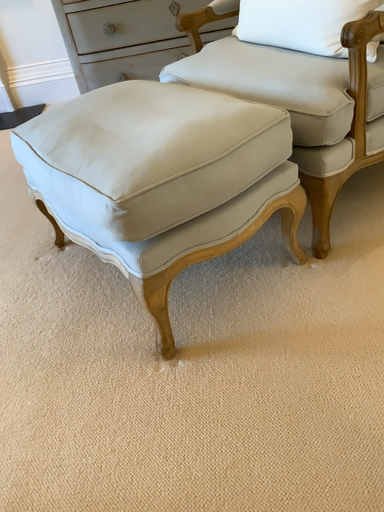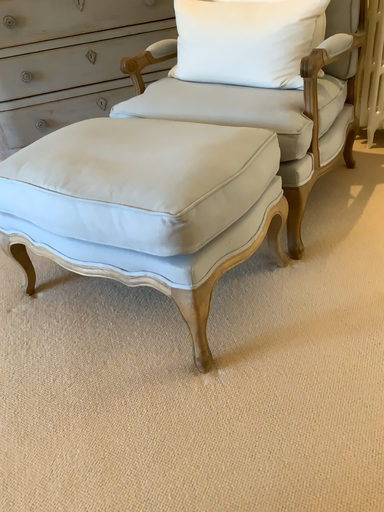
Question: Which way did the camera rotate in the video?

Choices:
 (A) rotated downward
 (B) rotated upward

Answer: (B)